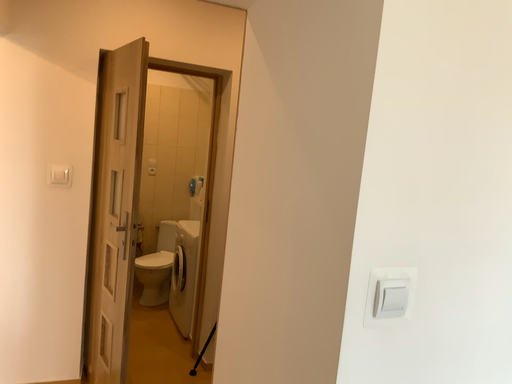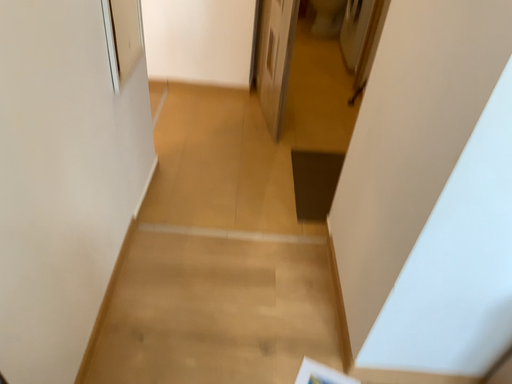
Question: Which way did the camera rotate in the video?

Choices:
 (A) rotated right
 (B) rotated left

Answer: (B)